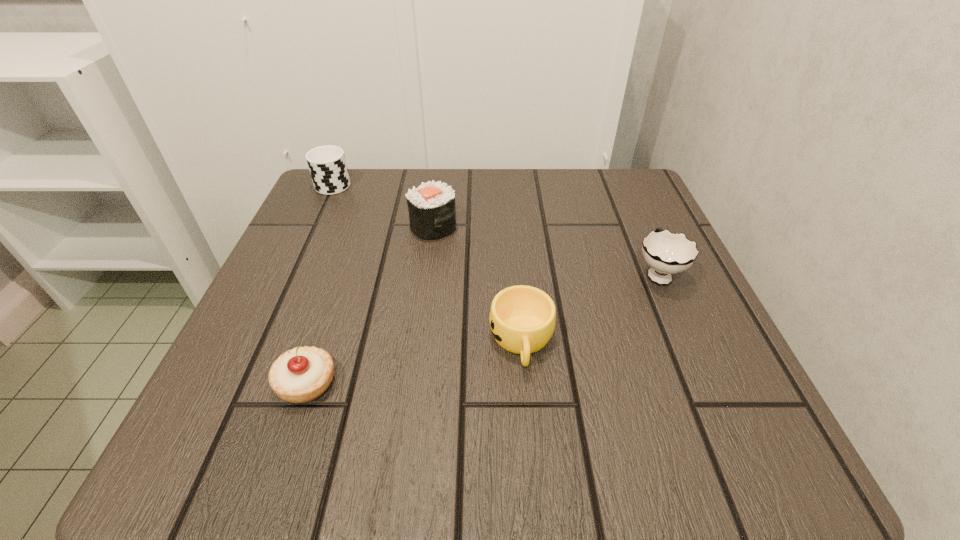
This screenshot has width=960, height=540. I want to click on free space between the third nearest object and the second object from left to right, so click(482, 328).

Locate an element on the screen. Image resolution: width=960 pixels, height=540 pixels. vacant area that lies between the rightmost object and the second object from right to left is located at coordinates (589, 307).

Identify the location of unoccupied area between the fourth nearest object and the shortest cup. This screenshot has width=960, height=540. (477, 284).

Identify the location of unoccupied position between the second farthest cup and the second object from left to right. (x=482, y=328).

You are a GUI agent. You are given a task and a screenshot of the screen. Output one action in this format:
    pyautogui.click(x=<x>, y=<y>)
    Task: Click on the vacant area that lies between the second nearest cup and the second farthest object
    This screenshot has height=540, width=960.
    Given the screenshot: What is the action you would take?
    pyautogui.click(x=545, y=249)

Identify the location of vacant area between the second object from right to left and the farthest cup. This screenshot has height=540, width=960. (428, 262).

Identify the location of empty space between the fourth object from right to left and the second cup from left to right. (414, 362).

I want to click on vacant space that is in between the rightmost cup and the third object from right to left, so click(545, 249).

Identify the location of unoccupied area between the sushi and the second cup from right to left. (477, 284).

Identify the location of vacant space that is in between the third farthest object and the leftmost cup. Image resolution: width=960 pixels, height=540 pixels. (495, 228).